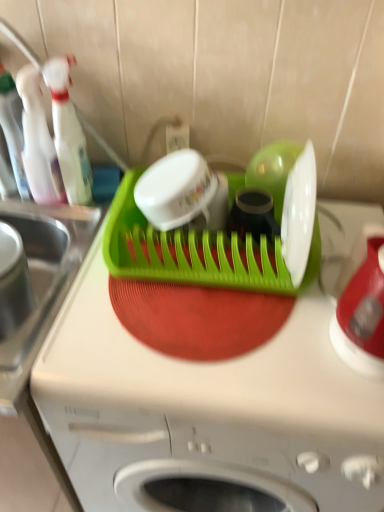
Question: Is transparent plastic spray bottle at upper left, which ranks as the 3th bottle in left-to-right order, facing away from green plastic dish rack at center?

Choices:
 (A) yes
 (B) no

Answer: (B)

Question: From the image's perspective, is transparent plastic spray bottle at upper left, which ranks as the 3th bottle in left-to-right order, under green plastic dish rack at center?

Choices:
 (A) yes
 (B) no

Answer: (B)

Question: Is transparent plastic spray bottle at upper left, which ranks as the 3th bottle in left-to-right order, further to camera compared to green plastic dish rack at center?

Choices:
 (A) yes
 (B) no

Answer: (A)

Question: From a real-world perspective, is transparent plastic spray bottle at upper left, which ranks as the 3th bottle in left-to-right order, below green plastic dish rack at center?

Choices:
 (A) no
 (B) yes

Answer: (A)

Question: Does transparent plastic spray bottle at upper left, the first bottle viewed from the right, have a smaller size compared to green plastic dish rack at center?

Choices:
 (A) yes
 (B) no

Answer: (A)

Question: Is green plastic dish rack at center, placed as the second appliance when sorted from right to left, inside or outside of green plastic dish rack at center?

Choices:
 (A) outside
 (B) inside

Answer: (A)

Question: From the image's perspective, is green plastic dish rack at center, the 1th appliance positioned from the left, located above or below green plastic dish rack at center?

Choices:
 (A) above
 (B) below

Answer: (A)

Question: Considering the positions of point (243, 278) and point (150, 468), is point (243, 278) closer or farther from the camera than point (150, 468)?

Choices:
 (A) closer
 (B) farther

Answer: (A)

Question: Considering the positions of green plastic dish rack at center, the 1th appliance positioned from the left, and green plastic dish rack at center in the image, is green plastic dish rack at center, the 1th appliance positioned from the left, bigger or smaller than green plastic dish rack at center?

Choices:
 (A) big
 (B) small

Answer: (B)

Question: From a real-world perspective, is transparent plastic bottle at left, the third bottle positioned from the right, physically located above or below brushed metal sink at left?

Choices:
 (A) above
 (B) below

Answer: (A)

Question: From the image's perspective, relative to brushed metal sink at left, is transparent plastic bottle at left, arranged as the 1th bottle when viewed from the left, above or below?

Choices:
 (A) above
 (B) below

Answer: (A)

Question: Considering the positions of transparent plastic bottle at left, the third bottle positioned from the right, and brushed metal sink at left in the image, is transparent plastic bottle at left, the third bottle positioned from the right, wider or thinner than brushed metal sink at left?

Choices:
 (A) thin
 (B) wide

Answer: (A)

Question: Does point (13, 100) appear closer or farther from the camera than point (36, 278)?

Choices:
 (A) farther
 (B) closer

Answer: (A)

Question: From the image's perspective, is transparent plastic bottle at left, the third bottle positioned from the right, located above or below translucent plastic bottle at left, which is the second bottle from left to right?

Choices:
 (A) below
 (B) above

Answer: (B)

Question: Looking at their shapes, would you say transparent plastic bottle at left, the third bottle positioned from the right, is wider or thinner than translucent plastic bottle at left, which is counted as the second bottle, starting from the right?

Choices:
 (A) thin
 (B) wide

Answer: (A)